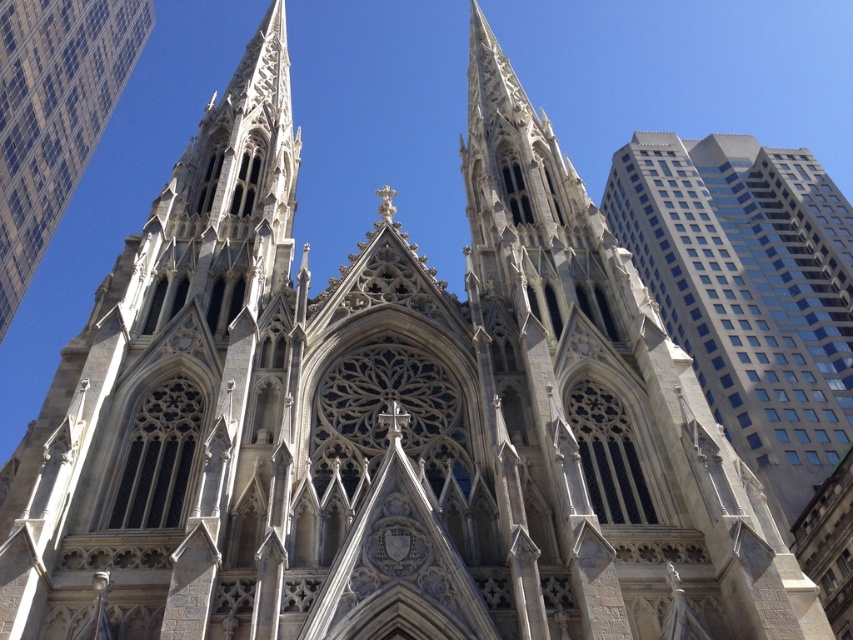
Is glassy reflective skyscraper at right to the left of white stone tower at upper left from the viewer's perspective?

In fact, glassy reflective skyscraper at right is to the right of white stone tower at upper left.

Can you confirm if glassy reflective skyscraper at right is taller than white stone tower at upper left?

Correct, glassy reflective skyscraper at right is much taller as white stone tower at upper left.

Does point (849, 413) come behind point (44, 90)?

Yes, it is.

You are a GUI agent. You are given a task and a screenshot of the screen. Output one action in this format:
    pyautogui.click(x=<x>, y=<y>)
    Task: Click on the glassy reflective skyscraper at right
    This screenshot has width=853, height=640.
    Given the screenshot: What is the action you would take?
    pyautogui.click(x=747, y=292)